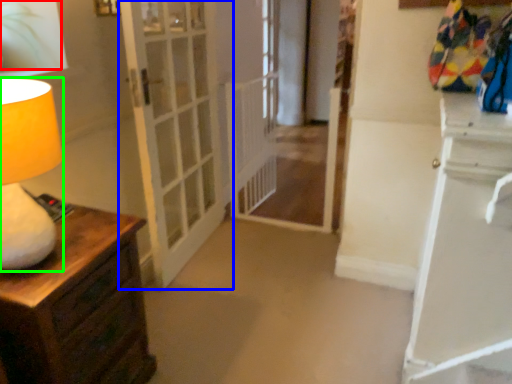
Question: Which is farther away from plant (highlighted by a red box)? door (highlighted by a blue box) or table lamp (highlighted by a green box)?

Choices:
 (A) door
 (B) table lamp

Answer: (A)